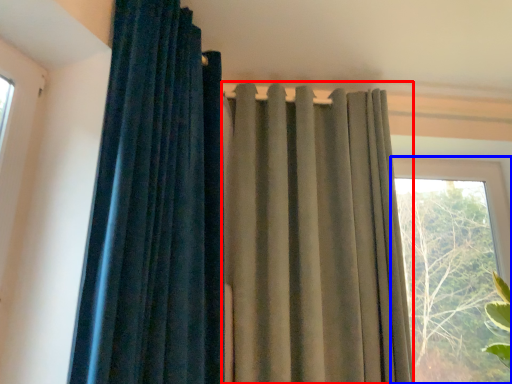
Question: Which object appears farthest to the camera in this image, curtain (highlighted by a red box) or window (highlighted by a blue box)?

Choices:
 (A) curtain
 (B) window

Answer: (B)